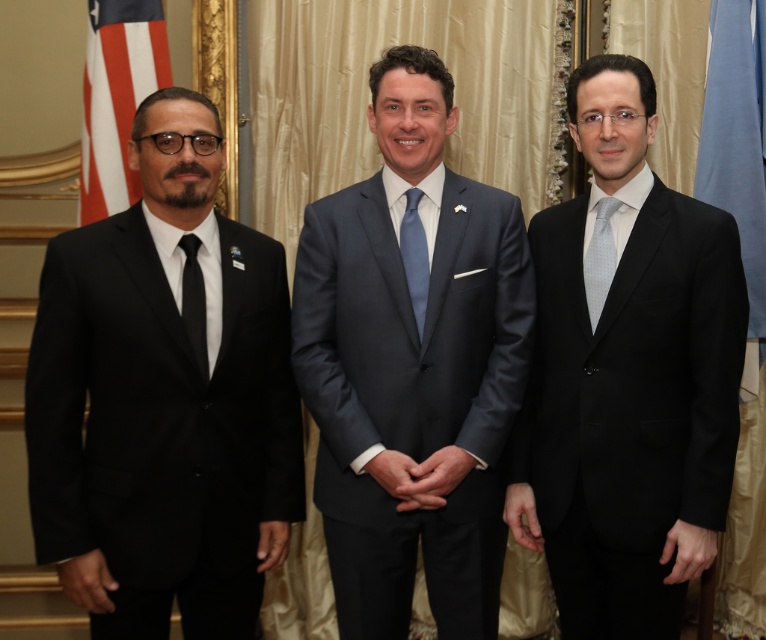
Question: In this image, where is blue fabric flag at right located relative to black silk tie at left?

Choices:
 (A) above
 (B) below

Answer: (A)

Question: Which of the following is the closest to the observer?

Choices:
 (A) (185, 244)
 (B) (125, 102)

Answer: (A)

Question: Does american flag at left have a lesser width compared to light blue dotted tie at center?

Choices:
 (A) no
 (B) yes

Answer: (A)

Question: Which point appears closest to the camera in this image?

Choices:
 (A) (475, 182)
 (B) (745, 328)
 (C) (201, 364)
 (D) (414, 284)

Answer: (C)

Question: Is matte black suit at right bigger than blue fabric flag at right?

Choices:
 (A) no
 (B) yes

Answer: (B)

Question: Which of the following is the farthest from the observer?

Choices:
 (A) black silk tie at left
 (B) light blue silk tie at center

Answer: (B)